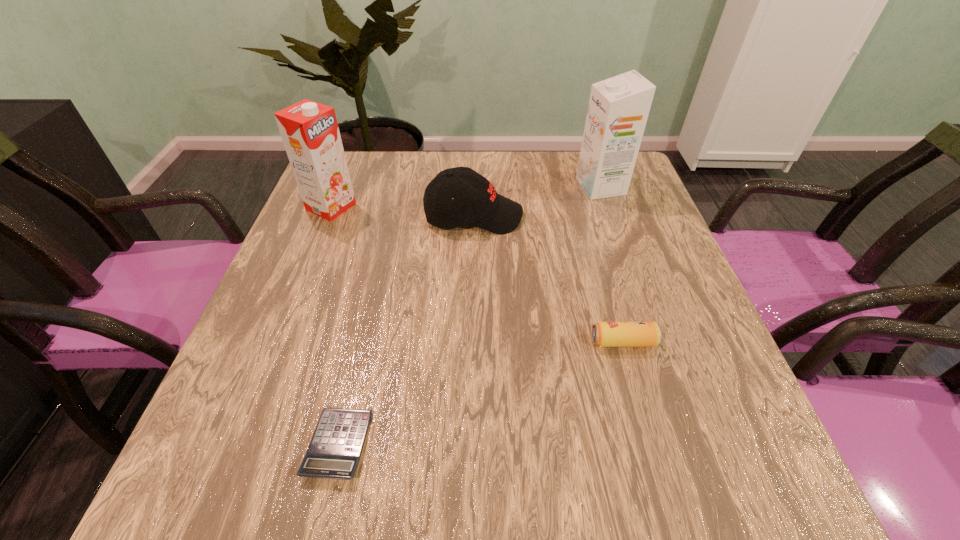
This screenshot has width=960, height=540. Identify the location of vacant area that lies between the right carton and the shortest object. (469, 315).

You are a GUI agent. You are given a task and a screenshot of the screen. Output one action in this format:
    pyautogui.click(x=<x>, y=<y>)
    Task: Click on the empty space that is in between the left carton and the second shortest object
    
    Given the screenshot: What is the action you would take?
    pyautogui.click(x=477, y=274)

Identify the location of vacant area between the third object from left to right and the right carton. (538, 201).

Identify the location of unoccupied area between the beer can and the right carton. (612, 265).

Identify which object is the closest to the left carton. Please provide its 2D coordinates. Your answer should be formatted as a tuple, i.e. [(x, y)], where the tuple contains the x and y coordinates of a point satisfying the conditions above.

[(475, 201)]

In order to click on the third closest object to the left carton in this screenshot , I will do `click(618, 109)`.

This screenshot has width=960, height=540. In order to click on blank area in the image that satisfies the following two spatial constraints: 1. on the front-facing side of the beer can; 2. on the left side of the third object from left to right in this screenshot , I will do `click(471, 342)`.

The width and height of the screenshot is (960, 540). Find the location of `free space that satisfies the following two spatial constraints: 1. on the front side of the beer can; 2. on the left side of the leftmost object`. free space that satisfies the following two spatial constraints: 1. on the front side of the beer can; 2. on the left side of the leftmost object is located at coordinates (276, 342).

Where is `free location that satisfies the following two spatial constraints: 1. on the front side of the left carton; 2. on the right side of the second nearest object`? The width and height of the screenshot is (960, 540). free location that satisfies the following two spatial constraints: 1. on the front side of the left carton; 2. on the right side of the second nearest object is located at coordinates (276, 342).